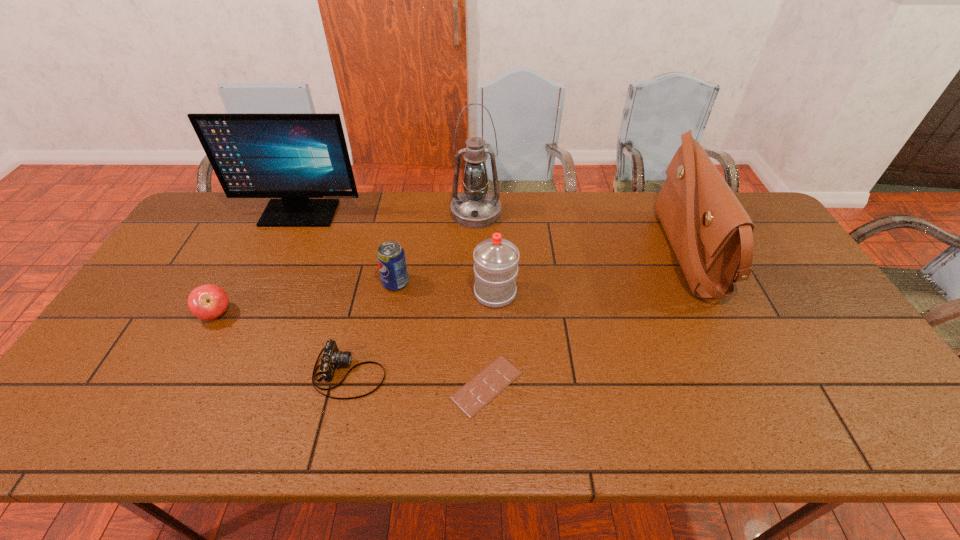
Identify the location of vacant space located on the left of the chocolate bar. (303, 385).

At what (x,y) coordinates should I click in order to perform the action: click on oil lamp positioned at the far edge. Please return your answer as a coordinate pair (x, y). Image resolution: width=960 pixels, height=540 pixels. Looking at the image, I should click on (475, 207).

You are a GUI agent. You are given a task and a screenshot of the screen. Output one action in this format:
    pyautogui.click(x=<x>, y=<y>)
    Task: Click on the monitor that is positioned at the far edge
    
    Given the screenshot: What is the action you would take?
    pyautogui.click(x=294, y=157)

Locate an element on the screen. This screenshot has height=540, width=960. satchel at the far edge is located at coordinates (711, 234).

Image resolution: width=960 pixels, height=540 pixels. I want to click on object that is positioned at the near edge, so click(486, 385).

What are the coordinates of `object at the left edge` in the screenshot? It's located at (294, 157).

This screenshot has height=540, width=960. I want to click on object that is at the far left corner, so click(x=294, y=157).

In the image, there is a desktop. Identify the location of blank space at the far edge. This screenshot has height=540, width=960. (371, 217).

Identify the location of vacant space at the near edge of the desktop. This screenshot has height=540, width=960. (411, 434).

The height and width of the screenshot is (540, 960). In the image, there is a desktop. Identify the location of free space at the left edge. (75, 396).